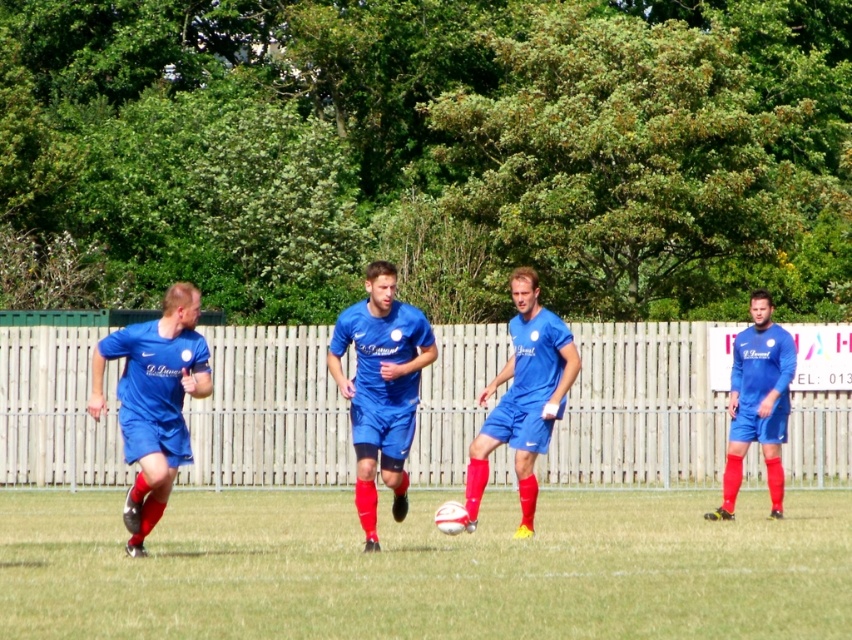
You are a soccer player standing at the point marked as point (266, 570) on the field. You want to kick the ball to your teammate who is standing 10 meters away from you in the direction opposite to the wooden fence. Will you be able to reach your teammate with a kick that travels exactly 10 meters?

The distance between point (266, 570) and the viewer is 12.73 meters. Since the teammate is 10 meters away from you in the direction opposite to the wooden fence, which is shorter than 12.73 meters, you can reach your teammate with a 10 meter kick.

Looking at this image, you are a soccer player trying to kick the ball towards the goal. You notice the green grass at center and the matte blue shorts at center. Which object is closer to the ball?

The matte blue shorts at center are closer to the ball because they are positioned above the green grass at center.